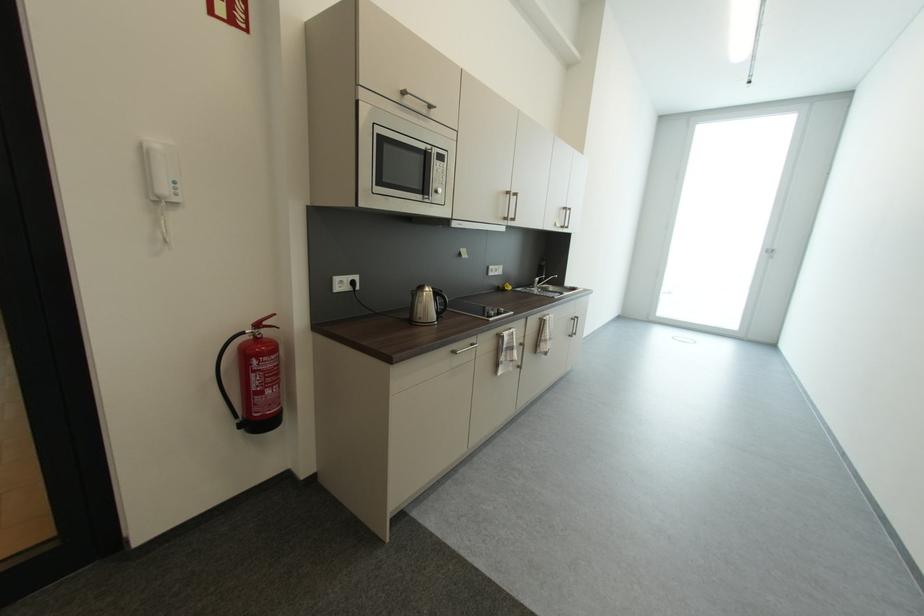
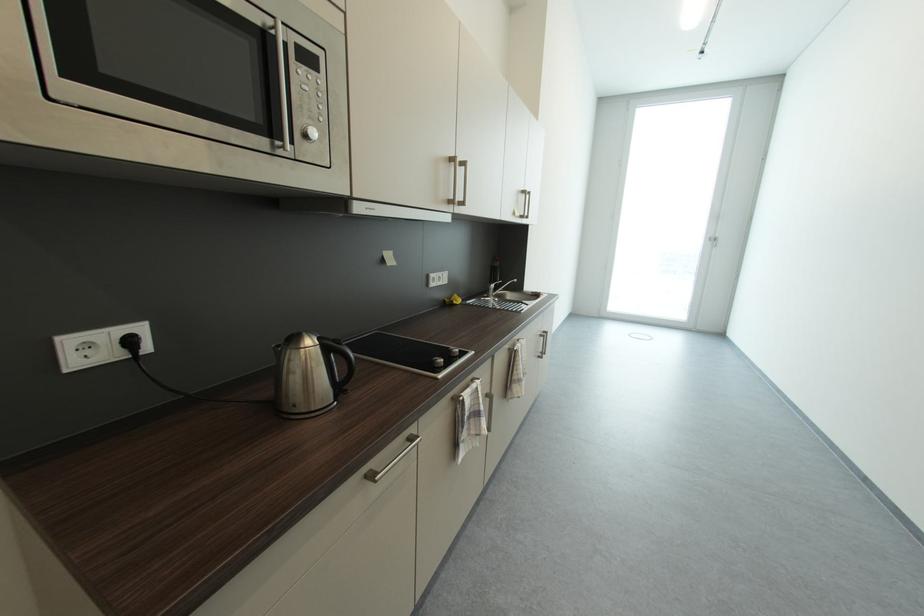
Question: The images are taken continuously from a first-person perspective. In which direction are you moving?

Choices:
 (A) Left
 (B) Right
 (C) Forward
 (D) Backward

Answer: (C)